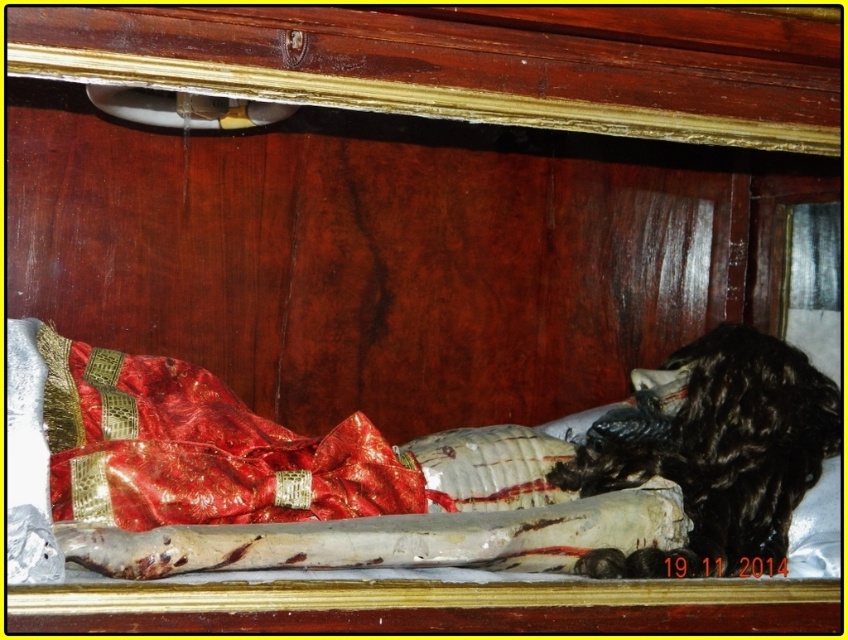
Question: Does red satin bed at center have a larger size compared to shiny red fabric at lower left?

Choices:
 (A) no
 (B) yes

Answer: (B)

Question: Is red satin bed at center above black fur animal at right?

Choices:
 (A) yes
 (B) no

Answer: (B)

Question: Which point is closer to the camera?

Choices:
 (A) red satin bed at center
 (B) black fur animal at right

Answer: (A)

Question: Which object is the farthest from the red satin bed at center?

Choices:
 (A) black fur animal at right
 (B) shiny red fabric at lower left

Answer: (A)

Question: Which object is positioned farthest from the red satin bed at center?

Choices:
 (A) shiny red fabric at lower left
 (B) black fur animal at right

Answer: (B)

Question: Is red satin bed at center positioned in front of black fur animal at right?

Choices:
 (A) yes
 (B) no

Answer: (A)